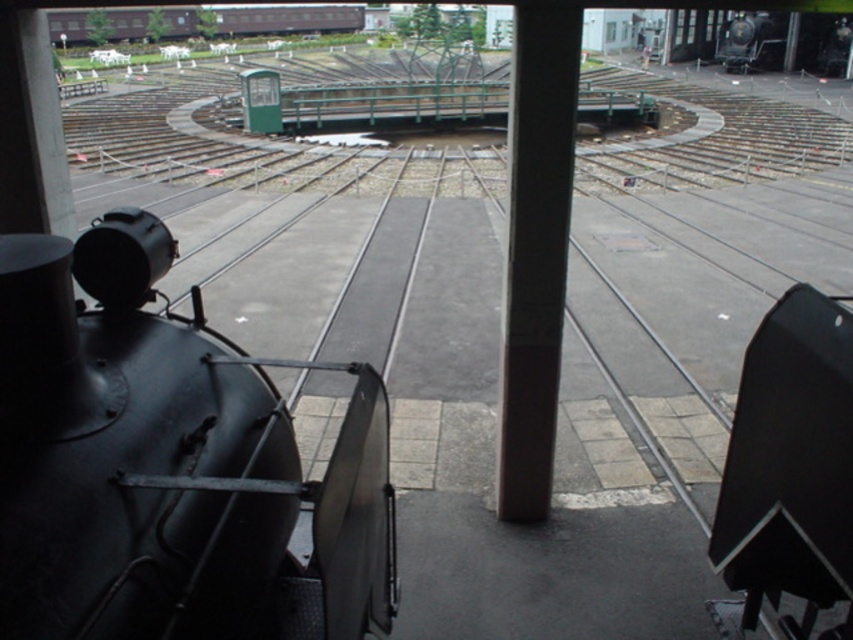
Question: Can you confirm if smooth gray pole at center is bigger than brown wooden train car at upper left?

Choices:
 (A) no
 (B) yes

Answer: (A)

Question: Can you confirm if matte black steam engine at left is smaller than smooth gray pole at center?

Choices:
 (A) no
 (B) yes

Answer: (A)

Question: Among these points, which one is nearest to the camera?

Choices:
 (A) (140, 28)
 (B) (83, 580)

Answer: (B)

Question: In this image, where is smooth gray pole at center located relative to brown wooden train car at upper left?

Choices:
 (A) right
 (B) left

Answer: (A)

Question: Which point is closer to the camera?

Choices:
 (A) (260, 490)
 (B) (120, 29)
 (C) (505, 346)

Answer: (A)

Question: Which point is closer to the camera?

Choices:
 (A) matte black steam engine at left
 (B) smooth gray pole at center
 (C) brown wooden train car at upper left

Answer: (A)